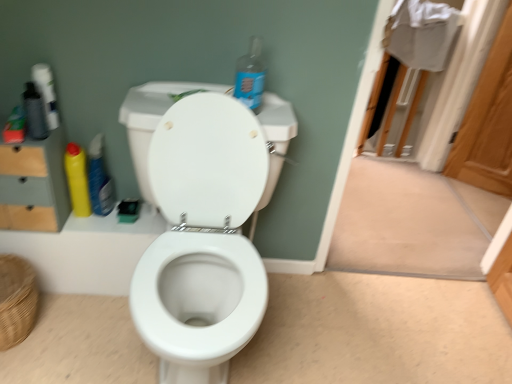
Question: Can you confirm if yellow matte bottle at left, which ranks as the 1th cleaning product in left-to-right order, is taller than blue plastic bottle at upper center, which appears as the first cleaning product when viewed from the right?

Choices:
 (A) no
 (B) yes

Answer: (B)

Question: Does yellow matte bottle at left, the third cleaning product from the right, appear on the right side of blue plastic bottle at upper center, which appears as the first cleaning product when viewed from the right?

Choices:
 (A) no
 (B) yes

Answer: (A)

Question: Could you tell me if yellow matte bottle at left, the third cleaning product from the right, is turned towards blue plastic bottle at upper center, the third cleaning product positioned from the left?

Choices:
 (A) no
 (B) yes

Answer: (A)

Question: From the image's perspective, is yellow matte bottle at left, the third cleaning product from the right, located above blue plastic bottle at upper center, the third cleaning product positioned from the left?

Choices:
 (A) yes
 (B) no

Answer: (B)

Question: Does yellow matte bottle at left, the third cleaning product from the right, have a larger size compared to blue plastic bottle at upper center, which appears as the first cleaning product when viewed from the right?

Choices:
 (A) no
 (B) yes

Answer: (A)

Question: From the image's perspective, relative to yellow matte bottle at left, the third cleaning product from the right, is wooden screen door at upper right above or below?

Choices:
 (A) above
 (B) below

Answer: (A)

Question: Is wooden screen door at upper right inside the boundaries of yellow matte bottle at left, which ranks as the 1th cleaning product in left-to-right order, or outside?

Choices:
 (A) inside
 (B) outside

Answer: (B)

Question: In terms of height, does wooden screen door at upper right look taller or shorter compared to yellow matte bottle at left, which ranks as the 1th cleaning product in left-to-right order?

Choices:
 (A) short
 (B) tall

Answer: (B)

Question: From a real-world perspective, is wooden screen door at upper right physically located above or below yellow matte bottle at left, which ranks as the 1th cleaning product in left-to-right order?

Choices:
 (A) below
 (B) above

Answer: (B)

Question: Considering the positions of point (89, 150) and point (53, 211), is point (89, 150) closer or farther from the camera than point (53, 211)?

Choices:
 (A) closer
 (B) farther

Answer: (B)

Question: Considering the positions of yellow plastic bottle at left, arranged as the second cleaning product when viewed from the left, and wooden dresser at left in the image, is yellow plastic bottle at left, arranged as the second cleaning product when viewed from the left, wider or thinner than wooden dresser at left?

Choices:
 (A) wide
 (B) thin

Answer: (B)

Question: Is yellow plastic bottle at left, marked as the 2th cleaning product in a right-to-left arrangement, taller or shorter than wooden dresser at left?

Choices:
 (A) short
 (B) tall

Answer: (A)

Question: From the image's perspective, is yellow plastic bottle at left, arranged as the second cleaning product when viewed from the left, positioned above or below wooden dresser at left?

Choices:
 (A) below
 (B) above

Answer: (A)

Question: From a real-world perspective, is woven brown basket at lower left positioned above or below yellow matte bottle at left, which ranks as the 1th cleaning product in left-to-right order?

Choices:
 (A) below
 (B) above

Answer: (A)

Question: Considering the positions of woven brown basket at lower left and yellow matte bottle at left, which ranks as the 1th cleaning product in left-to-right order, in the image, is woven brown basket at lower left wider or thinner than yellow matte bottle at left, which ranks as the 1th cleaning product in left-to-right order,?

Choices:
 (A) thin
 (B) wide

Answer: (B)